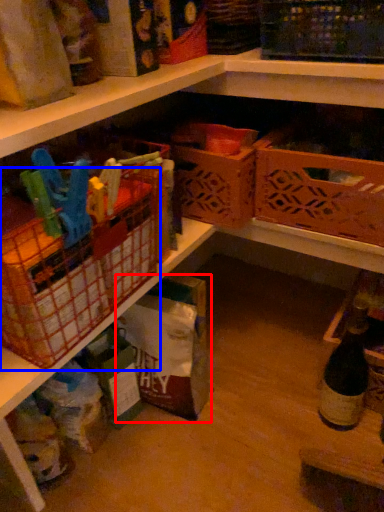
Question: Which object appears closest to the camera in this image, storage box (highlighted by a red box) or basket (highlighted by a blue box)?

Choices:
 (A) storage box
 (B) basket

Answer: (B)